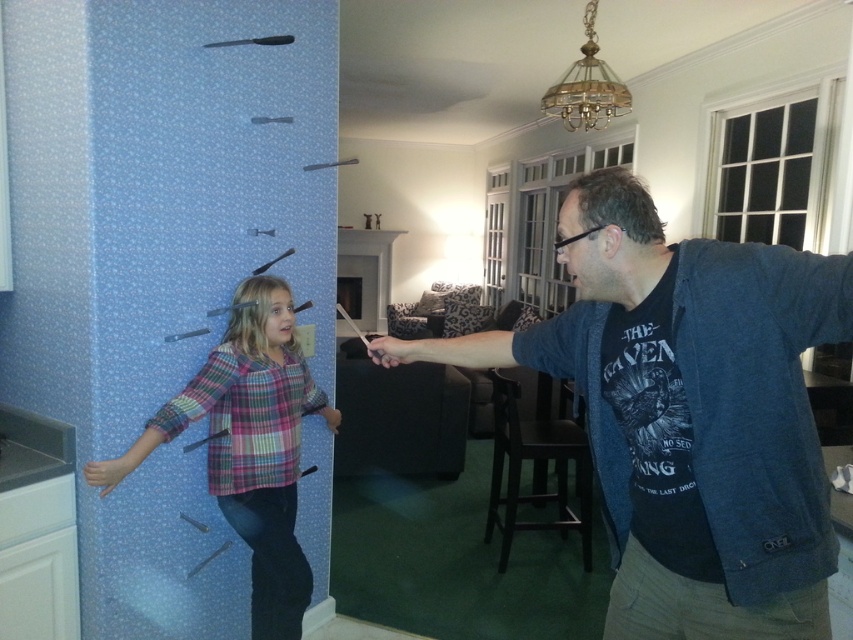
Question: Can you confirm if dark blue textured jacket at center right is positioned to the left of plaid fabric shirt at center?

Choices:
 (A) yes
 (B) no

Answer: (B)

Question: Does dark blue textured jacket at center right appear under plaid fabric shirt at center?

Choices:
 (A) yes
 (B) no

Answer: (B)

Question: Can you confirm if dark blue textured jacket at center right is positioned below plaid fabric shirt at center?

Choices:
 (A) yes
 (B) no

Answer: (B)

Question: Among these points, which one is farthest from the camera?

Choices:
 (A) (781, 403)
 (B) (277, 387)

Answer: (B)